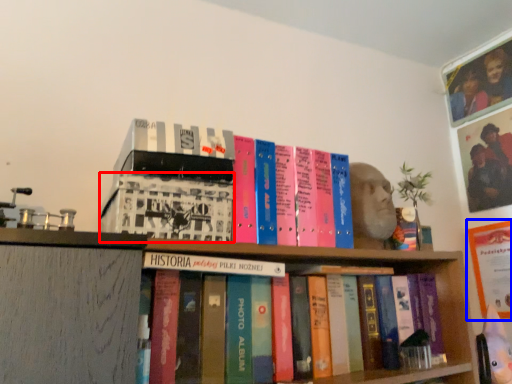
Question: Which object appears closest to the camera in this image, book (highlighted by a red box) or paperback book (highlighted by a blue box)?

Choices:
 (A) book
 (B) paperback book

Answer: (A)